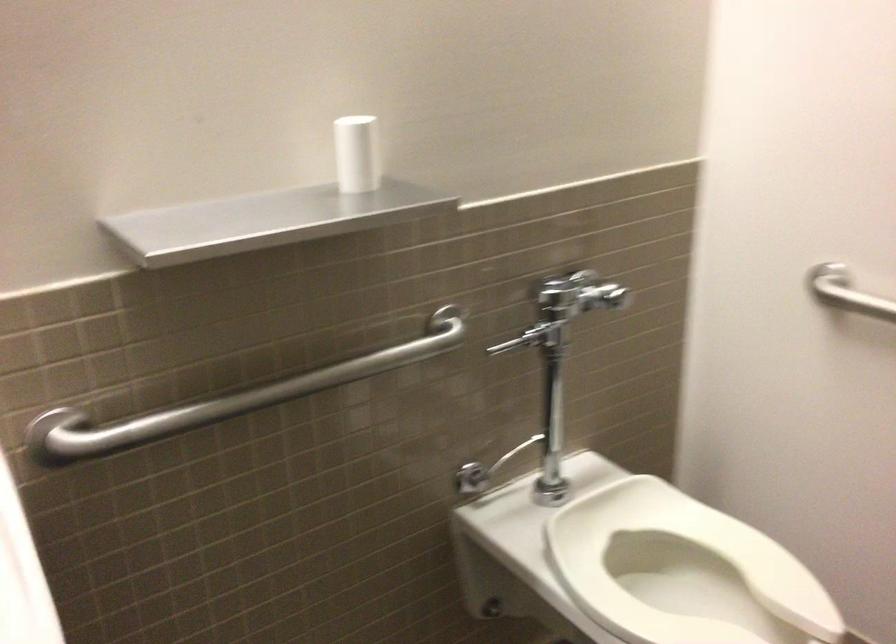
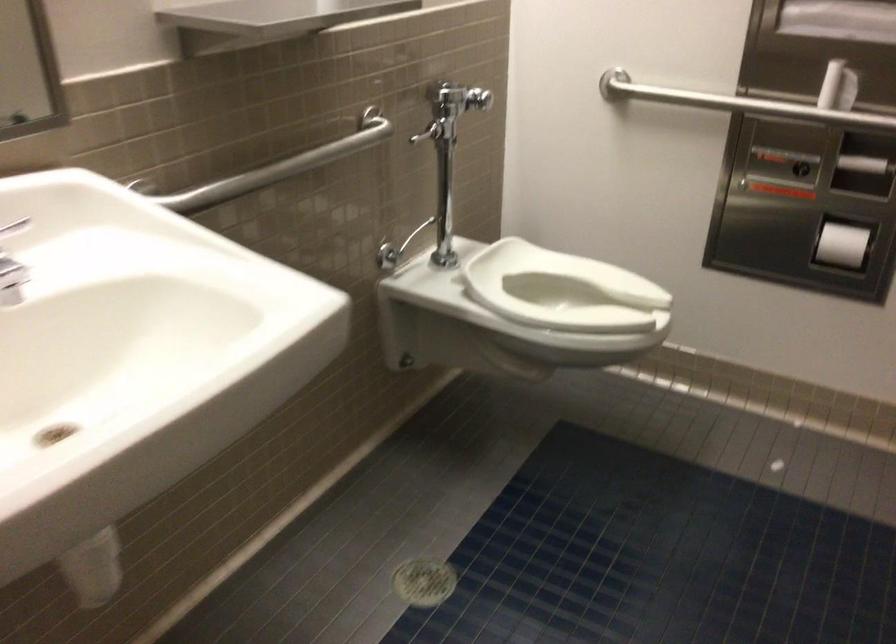
Question: Based on the continuous images, in which direction is the camera rotating? Reply with the corresponding letter.

Choices:
 (A) Left
 (B) Right
 (C) Up
 (D) Down

Answer: (B)